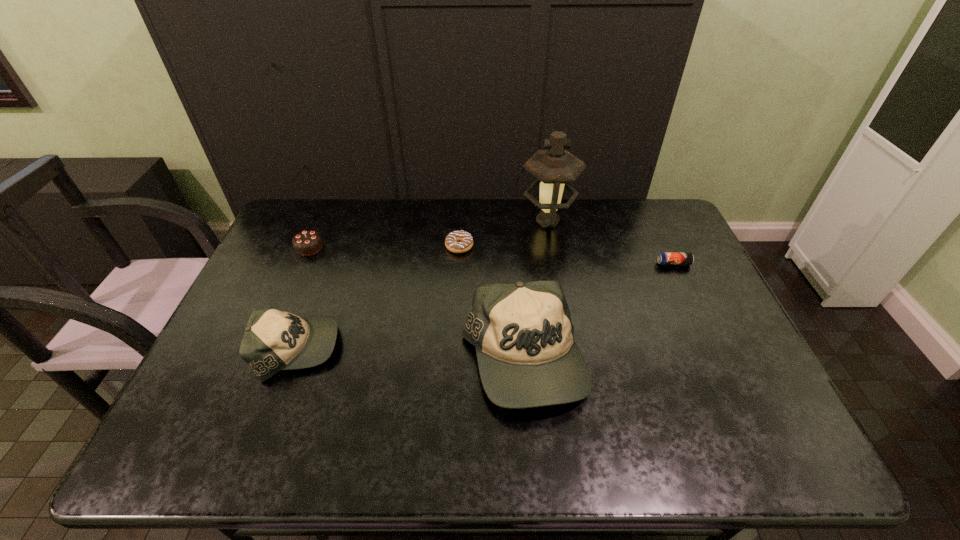
This screenshot has height=540, width=960. What are the coordinates of `object that is at the right edge` in the screenshot? It's located at (665, 258).

Where is `object located at the far left corner`? The width and height of the screenshot is (960, 540). object located at the far left corner is located at coordinates (307, 242).

At what (x,y) coordinates should I click in order to perform the action: click on object that is at the near left corner. Please return your answer as a coordinate pair (x, y). Image resolution: width=960 pixels, height=540 pixels. Looking at the image, I should click on (273, 340).

The image size is (960, 540). Find the location of `vacant space at the far edge of the desktop`. vacant space at the far edge of the desktop is located at coordinates (420, 234).

Identify the location of free spot at the near edge of the desktop. This screenshot has height=540, width=960. (418, 389).

At what (x,y) coordinates should I click in order to perform the action: click on free space at the left edge of the desktop. Please return your answer as a coordinate pair (x, y). This screenshot has height=540, width=960. Looking at the image, I should click on tap(290, 310).

Find the location of a particular element. vacant region at the right edge of the desktop is located at coordinates (x=686, y=356).

The width and height of the screenshot is (960, 540). In the image, there is a desktop. In order to click on vacant space at the far right corner in this screenshot , I will do `click(649, 205)`.

Identify the location of vacant area between the doughnut and the fourth farthest object. (566, 255).

I want to click on vacant point located between the left baseball cap and the chocolate cake, so pos(303,298).